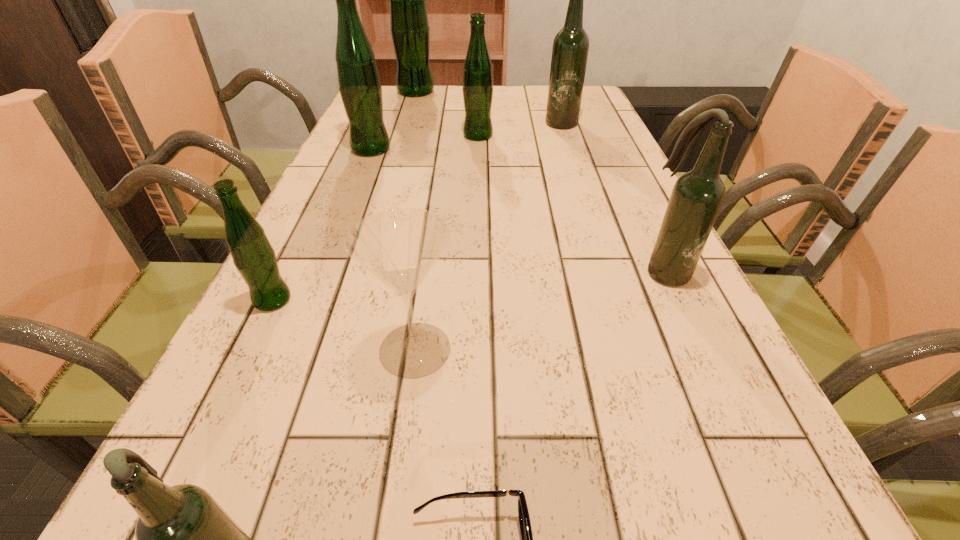
The width and height of the screenshot is (960, 540). Find the location of `the tallest beer bottle`. the tallest beer bottle is located at coordinates (409, 26).

At what (x,y) coordinates should I click in order to perform the action: click on the farthest object. Please return your answer as a coordinate pair (x, y). The width and height of the screenshot is (960, 540). Looking at the image, I should click on (409, 26).

You are a GUI agent. You are given a task and a screenshot of the screen. Output one action in this format:
    pyautogui.click(x=<x>, y=<y>)
    Task: Click on the second dark beer bottle from right to left
    The width and height of the screenshot is (960, 540).
    Given the screenshot: What is the action you would take?
    pyautogui.click(x=570, y=49)

Find the location of `the second object from right to left`. the second object from right to left is located at coordinates (570, 49).

You are a GUI agent. You are given a task and a screenshot of the screen. Output one action in this format:
    pyautogui.click(x=<x>, y=<y>)
    Task: Click on the third smallest green beer bottle
    This screenshot has width=960, height=540.
    Given the screenshot: What is the action you would take?
    pyautogui.click(x=360, y=88)

Identify the location of the rightmost green beer bottle. The height and width of the screenshot is (540, 960). (477, 89).

Where is `the third beer bottle from right to left`? the third beer bottle from right to left is located at coordinates (477, 89).

The width and height of the screenshot is (960, 540). Identify the location of the rightmost object. (697, 196).

Find the location of a particular element. the rightmost dark beer bottle is located at coordinates (697, 196).

At what (x,y) coordinates should I click in order to perform the action: click on the smallest green beer bottle. Please return your answer as a coordinate pair (x, y). Looking at the image, I should click on (253, 255).